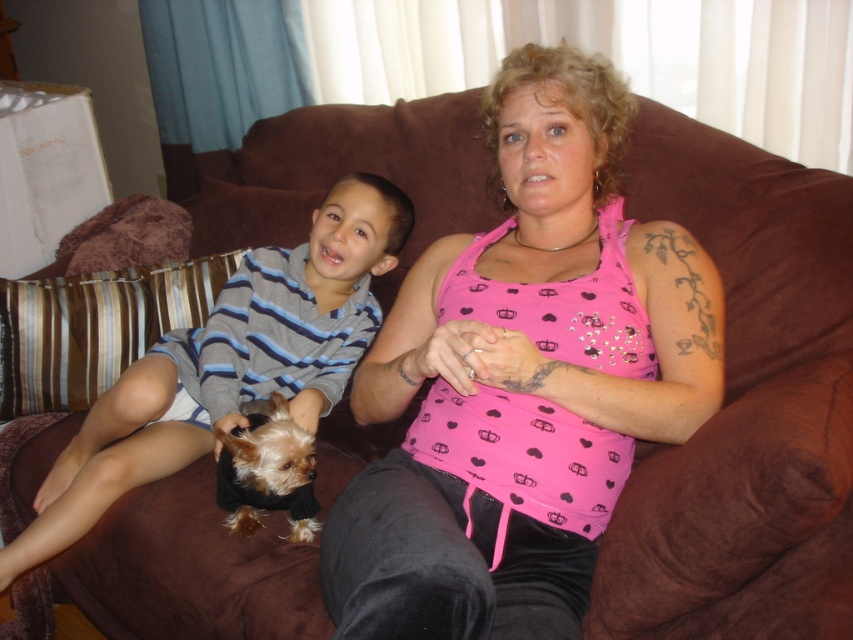
Which is above, pink fabric tank top at center or striped knit sweater at left?

Positioned higher is pink fabric tank top at center.

Who is more distant from viewer, (585, 531) or (97, 474)?

The point (97, 474) is more distant.

Between point (498, 180) and point (296, 320), which one is positioned behind?

The point (296, 320) is more distant.

Identify the location of pink fabric tank top at center. (521, 380).

Can you confirm if pink fabric tank top at center is smaller than black velvet pants at center?

Incorrect, pink fabric tank top at center is not smaller in size than black velvet pants at center.

This screenshot has width=853, height=640. In order to click on pink fabric tank top at center in this screenshot , I will do `click(521, 380)`.

The width and height of the screenshot is (853, 640). I want to click on pink fabric tank top at center, so click(521, 380).

Consider the image. Which is more to the right, black velvet pants at center or fuzzy black dog at center?

From the viewer's perspective, black velvet pants at center appears more on the right side.

Between point (550, 566) and point (277, 506), which one is positioned in front?

Positioned in front is point (550, 566).

Between point (461, 502) and point (231, 436), which one is positioned in front?

Positioned in front is point (461, 502).

The width and height of the screenshot is (853, 640). What are the coordinates of `black velvet pants at center` in the screenshot? It's located at (445, 561).